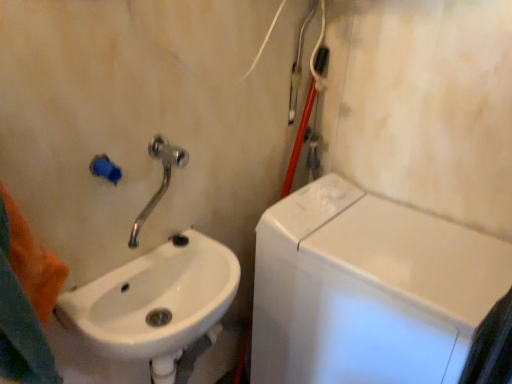
At what (x,y) coordinates should I click in order to perform the action: click on silver metallic faucet at upper left. Please return your answer as a coordinate pair (x, y). Image resolution: width=512 pixels, height=384 pixels. Looking at the image, I should click on (162, 180).

This screenshot has height=384, width=512. What do you see at coordinates (162, 180) in the screenshot? I see `silver metallic faucet at upper left` at bounding box center [162, 180].

In order to click on white glossy sink at lower left in this screenshot , I will do `click(157, 306)`.

Can you confirm if white glossy sink at lower left is thinner than silver metallic faucet at upper left?

No.

From the image's perspective, is white glossy sink at lower left located above silver metallic faucet at upper left?

No, from the image's perspective, white glossy sink at lower left is not on top of silver metallic faucet at upper left.

Looking at this image, can you confirm if white glossy sink at lower left is bigger than silver metallic faucet at upper left?

Yes, white glossy sink at lower left is bigger than silver metallic faucet at upper left.

Could you tell me if white glossy sink at lower left is turned towards silver metallic faucet at upper left?

No, white glossy sink at lower left is not turned towards silver metallic faucet at upper left.

Is silver metallic faucet at upper left inside or outside of white glossy sink at lower left?

silver metallic faucet at upper left is located beyond the bounds of white glossy sink at lower left.

Does silver metallic faucet at upper left come behind white glossy sink at lower left?

Yes, it is.

Image resolution: width=512 pixels, height=384 pixels. In order to click on tap that is behind the white glossy sink at lower left in this screenshot , I will do `click(162, 180)`.

What's the angular difference between silver metallic faucet at upper left and white glossy sink at lower left's facing directions?

The angle between the facing direction of silver metallic faucet at upper left and the facing direction of white glossy sink at lower left is 58.1 degrees.

Between silver metallic faucet at upper left and white glossy washing machine at right, which one has larger size?

With larger size is white glossy washing machine at right.

Considering the sizes of objects silver metallic faucet at upper left and white glossy washing machine at right in the image provided, who is shorter, silver metallic faucet at upper left or white glossy washing machine at right?

silver metallic faucet at upper left is shorter.

How many degrees apart are the facing directions of silver metallic faucet at upper left and white glossy washing machine at right?

The angle between the facing direction of silver metallic faucet at upper left and the facing direction of white glossy washing machine at right is 32.1 degrees.

Between white glossy washing machine at right and silver metallic faucet at upper left, which one appears on the left side from the viewer's perspective?

silver metallic faucet at upper left.

Is point (382, 245) closer or farther from the camera than point (152, 146)?

Point (382, 245) is positioned farther from the camera compared to point (152, 146).

From a real-world perspective, is white glossy washing machine at right physically below silver metallic faucet at upper left?

Indeed, from a real-world perspective, white glossy washing machine at right is positioned beneath silver metallic faucet at upper left.

Is silver metallic faucet at upper left inside white glossy washing machine at right?

No.

The width and height of the screenshot is (512, 384). There is a white glossy washing machine at right. What are the coordinates of `sink above it (from a real-world perspective)` in the screenshot? It's located at (157, 306).

From the image's perspective, is white glossy washing machine at right on white glossy sink at lower left?

No.

Which object is positioned more to the left, white glossy washing machine at right or white glossy sink at lower left?

white glossy sink at lower left is more to the left.

Is white glossy washing machine at right closer to camera compared to white glossy sink at lower left?

No, it is behind white glossy sink at lower left.

Relative to white glossy washing machine at right, is white glossy sink at lower left in front or behind?

white glossy sink at lower left is positioned closer to the viewer than white glossy washing machine at right.

Does white glossy sink at lower left have a greater height compared to white glossy washing machine at right?

No, white glossy sink at lower left is not taller than white glossy washing machine at right.

Looking at their sizes, would you say white glossy sink at lower left is wider or thinner than white glossy washing machine at right?

white glossy sink at lower left is thinner than white glossy washing machine at right.

Is point (158, 289) closer to viewer compared to point (474, 304)?

No, (158, 289) is further to viewer.

This screenshot has height=384, width=512. I want to click on tap lying behind the white glossy sink at lower left, so click(162, 180).

Where is `sink below the silver metallic faucet at upper left (from the image's perspective)`? The width and height of the screenshot is (512, 384). sink below the silver metallic faucet at upper left (from the image's perspective) is located at coordinates (157, 306).

Estimate the real-world distances between objects in this image. Which object is further from white glossy washing machine at right, white glossy sink at lower left or silver metallic faucet at upper left?

silver metallic faucet at upper left is further to white glossy washing machine at right.

Consider the image. Based on their spatial positions, is silver metallic faucet at upper left or white glossy sink at lower left closer to white glossy washing machine at right?

white glossy sink at lower left.

Consider the image. Considering their positions, is white glossy washing machine at right positioned closer to white glossy sink at lower left than silver metallic faucet at upper left?

silver metallic faucet at upper left is closer to white glossy sink at lower left.

Estimate the real-world distances between objects in this image. Which object is further from silver metallic faucet at upper left, white glossy sink at lower left or white glossy washing machine at right?

Among the two, white glossy washing machine at right is located further to silver metallic faucet at upper left.

Based on their spatial positions, is silver metallic faucet at upper left or white glossy washing machine at right closer to white glossy sink at lower left?

silver metallic faucet at upper left is positioned closer to the anchor white glossy sink at lower left.

Looking at the image, which one is located closer to silver metallic faucet at upper left, white glossy washing machine at right or white glossy sink at lower left?

white glossy sink at lower left.

Where is `sink situated between silver metallic faucet at upper left and white glossy washing machine at right from left to right`? This screenshot has height=384, width=512. sink situated between silver metallic faucet at upper left and white glossy washing machine at right from left to right is located at coordinates (157, 306).